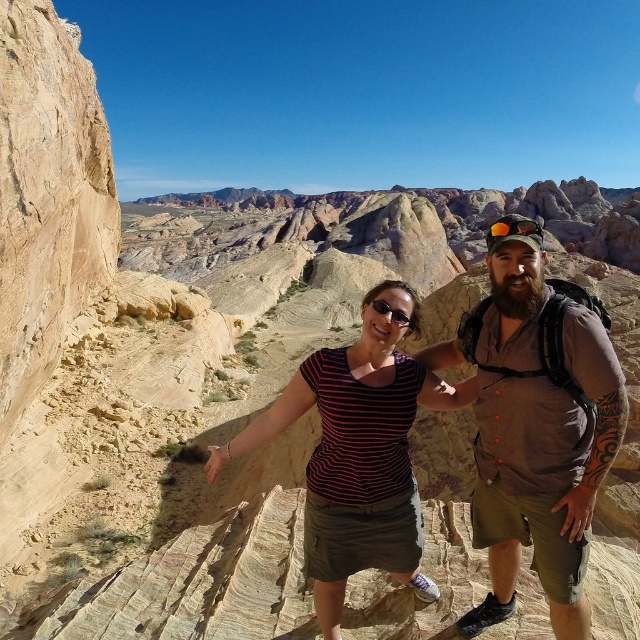
Which of these two, brown cotton shirt at center or striped fabric shirt at center, stands shorter?

striped fabric shirt at center

Find the location of a particular element. The width and height of the screenshot is (640, 640). brown cotton shirt at center is located at coordinates (536, 429).

Does point (520, 346) come farther from viewer compared to point (224, 464)?

No, (520, 346) is in front of (224, 464).

This screenshot has height=640, width=640. I want to click on brown cotton shirt at center, so click(536, 429).

Which is in front, point (356, 394) or point (540, 237)?

Positioned in front is point (540, 237).

Is striped fabric shirt at center shorter than matte orange goggles at upper right?

Incorrect, striped fabric shirt at center's height does not fall short of matte orange goggles at upper right's.

Find the location of `striped fabric shirt at center`. striped fabric shirt at center is located at coordinates (358, 451).

You are a GUI agent. You are given a task and a screenshot of the screen. Output one action in this format:
    pyautogui.click(x=<x>, y=<y>)
    Task: Click on the striped fabric shirt at center
    The height and width of the screenshot is (640, 640).
    Given the screenshot: What is the action you would take?
    pyautogui.click(x=358, y=451)

I want to click on brown cotton shirt at center, so click(x=536, y=429).

The width and height of the screenshot is (640, 640). I want to click on brown cotton shirt at center, so click(536, 429).